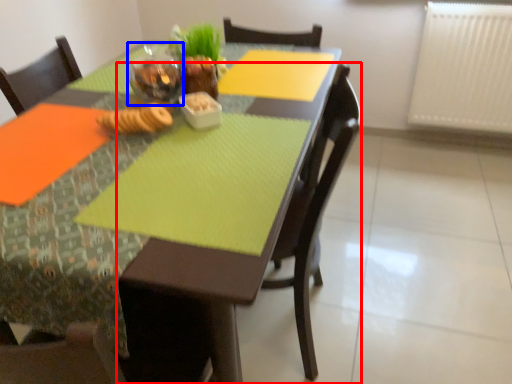
Question: Which object appears closest to the camera in this image, chair (highlighted by a red box) or tableware (highlighted by a blue box)?

Choices:
 (A) chair
 (B) tableware

Answer: (A)